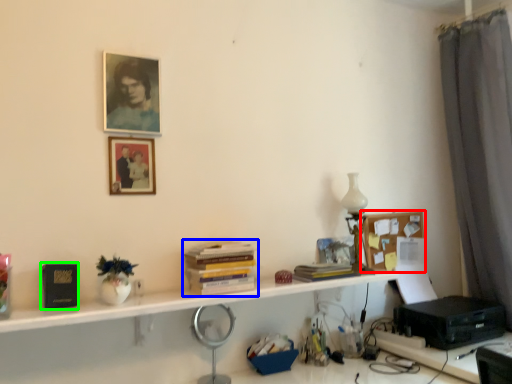
Question: Which object is the closest to the bulletin board (highlighted by a red box)? Choose among these: book (highlighted by a blue box) or paperback book (highlighted by a green box).

Choices:
 (A) book
 (B) paperback book

Answer: (A)